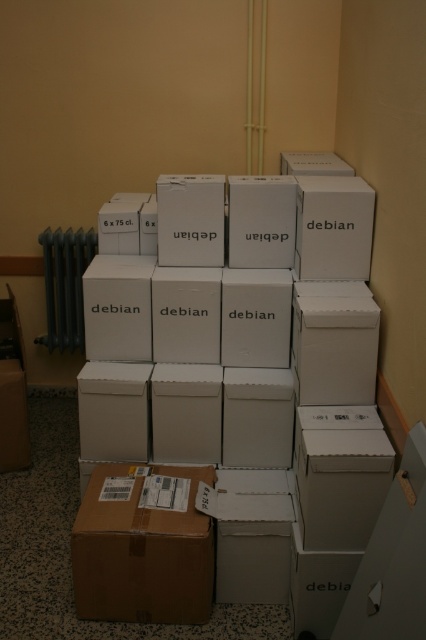
You are standing in the room and want to place a new box on the floor. The new box must be placed exactly at the same 2D location as the white cardboard box at center. Where should you place the new box?

You should place the new box at the 2D coordinates point (250, 374), which is the exact location of the white cardboard box at center.

You are organizing the boxes in the room. You need to move the brown cardboard box at lower left to a different location. Which direction should you move it so that it is now behind the white cardboard box at center?

To place the brown cardboard box at lower left behind the white cardboard box at center, you should move it away from the viewer since the white cardboard box at center is currently closer to the viewer than the brown cardboard box at lower left.